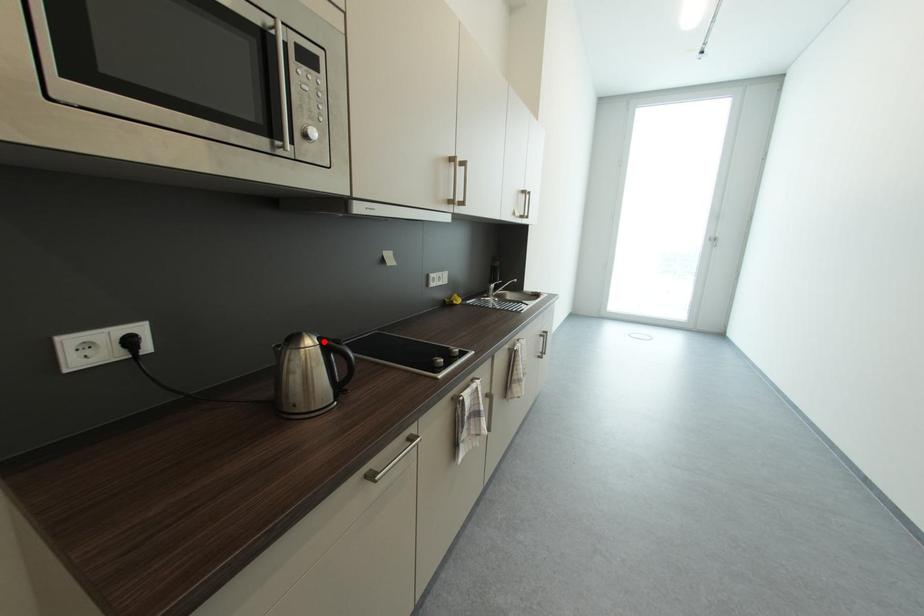
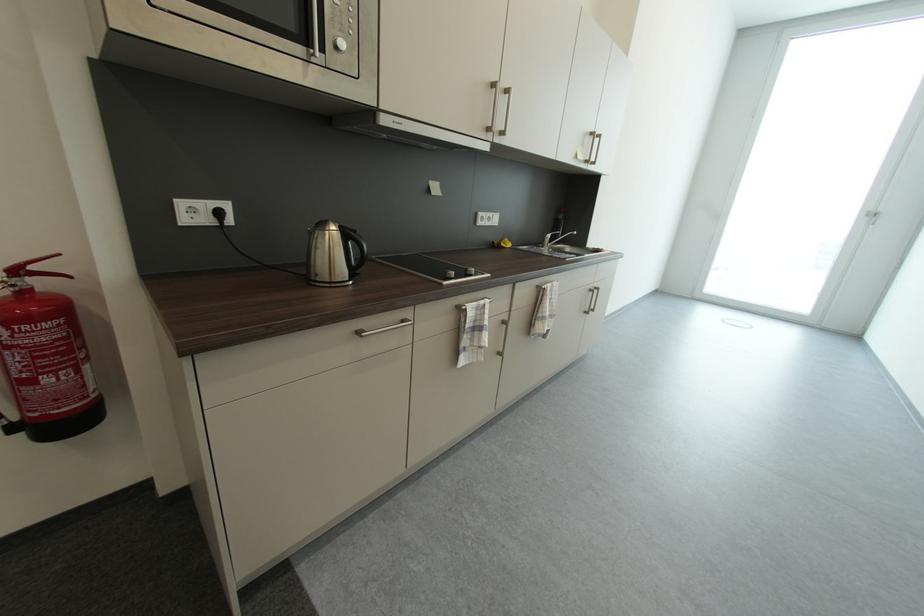
Locate, in the second image, the point that corresponds to the highlighted location in the first image.

(346, 228)